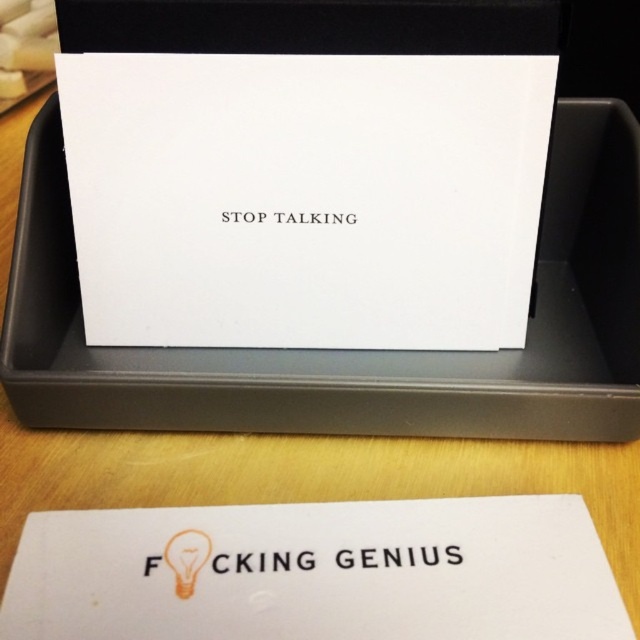
Is white paper at center to the right of white matte card at center from the viewer's perspective?

Yes, white paper at center is to the right of white matte card at center.

Who is positioned more to the right, white paper at center or white matte card at center?

white paper at center is more to the right.

Is point (236, 364) farther from viewer compared to point (294, 560)?

That is True.

The image size is (640, 640). Find the location of `white paper at center`. white paper at center is located at coordinates (355, 349).